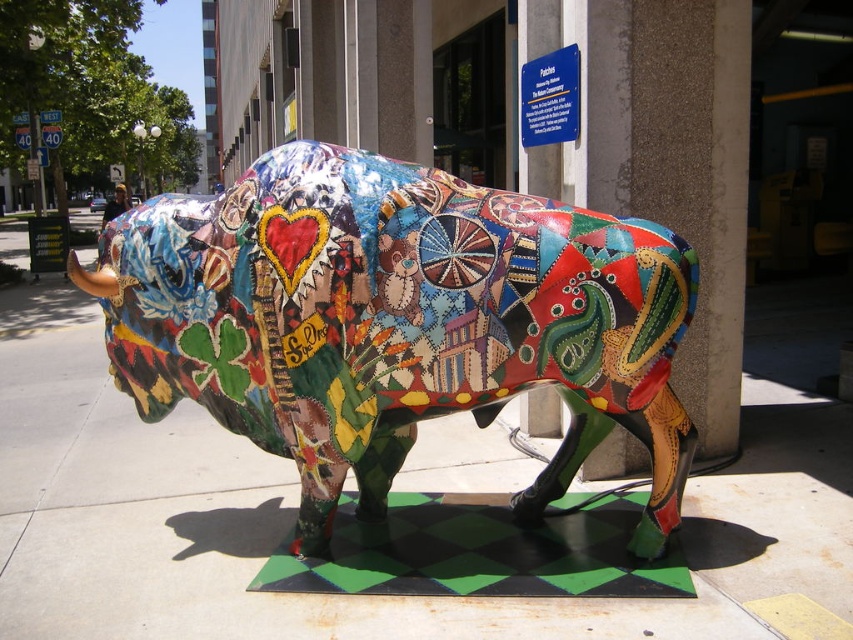
Question: Considering the relative positions of multicolored mosaic bull at center and green checkered mat at lower center in the image provided, where is multicolored mosaic bull at center located with respect to green checkered mat at lower center?

Choices:
 (A) below
 (B) above

Answer: (B)

Question: Which point appears closest to the camera in this image?

Choices:
 (A) (523, 515)
 (B) (560, 588)

Answer: (B)

Question: Which object appears farthest from the camera in this image?

Choices:
 (A) green checkered mat at lower center
 (B) multicolored mosaic bull at center

Answer: (A)

Question: Does multicolored mosaic bull at center lie behind green checkered mat at lower center?

Choices:
 (A) yes
 (B) no

Answer: (B)

Question: From the image, what is the correct spatial relationship of multicolored mosaic bull at center in relation to green checkered mat at lower center?

Choices:
 (A) above
 (B) below

Answer: (A)